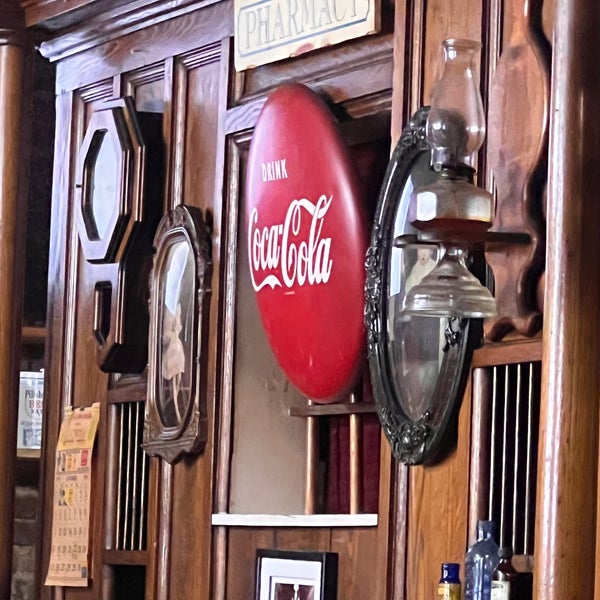
The height and width of the screenshot is (600, 600). I want to click on bottles, so click(x=483, y=579).